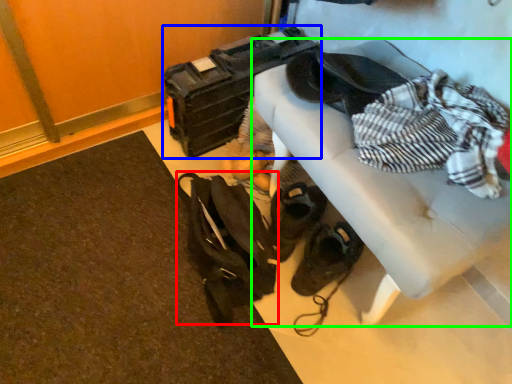
Question: Considering the real-world distances, which object is farthest from messenger bag (highlighted by a red box)? luggage (highlighted by a blue box) or furniture (highlighted by a green box)?

Choices:
 (A) luggage
 (B) furniture

Answer: (A)